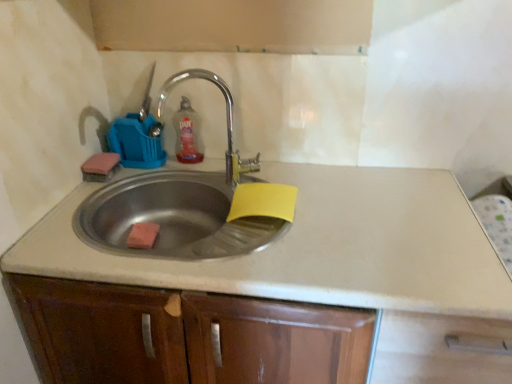
Question: Does stainless steel sink at center have a greater height compared to translucent plastic bottle at upper center?

Choices:
 (A) no
 (B) yes

Answer: (B)

Question: Is stainless steel sink at center touching translucent plastic bottle at upper center?

Choices:
 (A) yes
 (B) no

Answer: (B)

Question: Is stainless steel sink at center positioned behind translucent plastic bottle at upper center?

Choices:
 (A) no
 (B) yes

Answer: (A)

Question: Are stainless steel sink at center and translucent plastic bottle at upper center located far from each other?

Choices:
 (A) no
 (B) yes

Answer: (A)

Question: From the image's perspective, is stainless steel sink at center located beneath translucent plastic bottle at upper center?

Choices:
 (A) yes
 (B) no

Answer: (A)

Question: Relative to translucent plastic bottle at upper center, is stainless steel sink at center in front or behind?

Choices:
 (A) front
 (B) behind

Answer: (A)

Question: Considering the positions of stainless steel sink at center and translucent plastic bottle at upper center in the image, is stainless steel sink at center bigger or smaller than translucent plastic bottle at upper center?

Choices:
 (A) small
 (B) big

Answer: (B)

Question: From the image's perspective, is stainless steel sink at center located above or below translucent plastic bottle at upper center?

Choices:
 (A) above
 (B) below

Answer: (B)

Question: Would you say stainless steel sink at center is inside or outside translucent plastic bottle at upper center?

Choices:
 (A) outside
 (B) inside

Answer: (A)

Question: Would you say beige laminate countertop at center is to the left or to the right of orange sponge at sink in the picture?

Choices:
 (A) right
 (B) left

Answer: (A)

Question: Does point tap(134, 268) appear closer or farther from the camera than point tap(132, 233)?

Choices:
 (A) farther
 (B) closer

Answer: (B)

Question: From a real-world perspective, is beige laminate countertop at center above or below orange sponge at sink?

Choices:
 (A) above
 (B) below

Answer: (B)

Question: Is beige laminate countertop at center wider or thinner than orange sponge at sink?

Choices:
 (A) wide
 (B) thin

Answer: (A)

Question: Looking at the image, does beige laminate countertop at center seem bigger or smaller compared to translucent plastic bottle at upper center?

Choices:
 (A) big
 (B) small

Answer: (A)

Question: Considering the positions of beige laminate countertop at center and translucent plastic bottle at upper center in the image, is beige laminate countertop at center wider or thinner than translucent plastic bottle at upper center?

Choices:
 (A) wide
 (B) thin

Answer: (A)